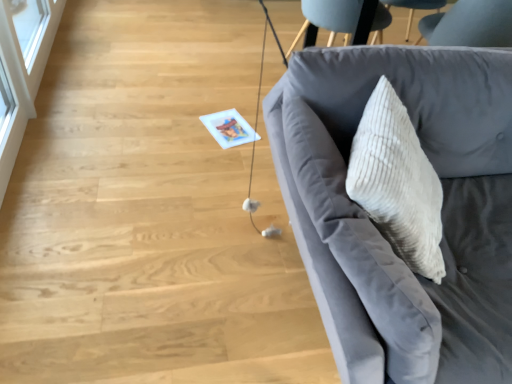
Question: Considering the positions of point (437, 114) and point (15, 109), is point (437, 114) closer or farther from the camera than point (15, 109)?

Choices:
 (A) farther
 (B) closer

Answer: (B)

Question: Would you say velvet gray couch at right is inside or outside transparent glass door at upper left?

Choices:
 (A) outside
 (B) inside

Answer: (A)

Question: Based on their sizes in the image, would you say velvet gray couch at right is bigger or smaller than transparent glass door at upper left?

Choices:
 (A) small
 (B) big

Answer: (B)

Question: Is transparent glass door at upper left situated inside velvet gray couch at right or outside?

Choices:
 (A) inside
 (B) outside

Answer: (B)

Question: In terms of size, does transparent glass door at upper left appear bigger or smaller than velvet gray couch at right?

Choices:
 (A) small
 (B) big

Answer: (A)

Question: Is transparent glass door at upper left wider or thinner than velvet gray couch at right?

Choices:
 (A) thin
 (B) wide

Answer: (A)

Question: From a real-world perspective, relative to velvet gray couch at right, is transparent glass door at upper left vertically above or below?

Choices:
 (A) above
 (B) below

Answer: (B)